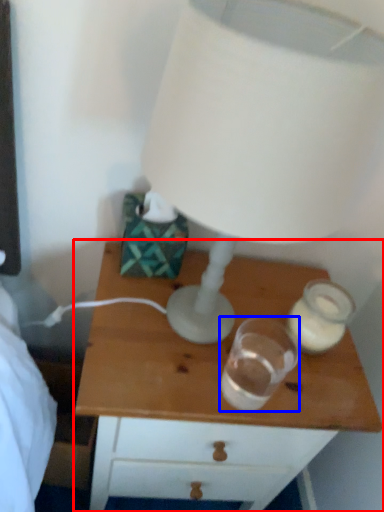
Question: Which point is further to the camera, nightstand (highlighted by a red box) or candle holder (highlighted by a blue box)?

Choices:
 (A) nightstand
 (B) candle holder

Answer: (A)